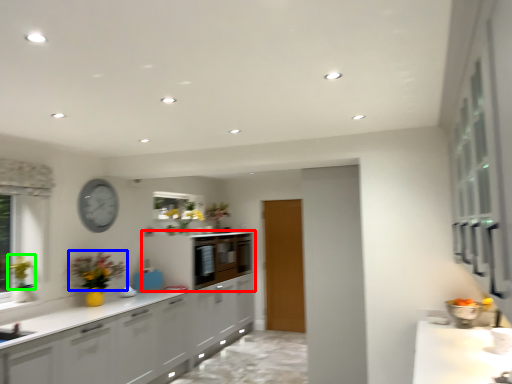
Question: Considering the real-world distances, which object is farthest from cabinetry (highlighted by a red box)? flower (highlighted by a blue box) or floral arrangement (highlighted by a green box)?

Choices:
 (A) flower
 (B) floral arrangement

Answer: (B)